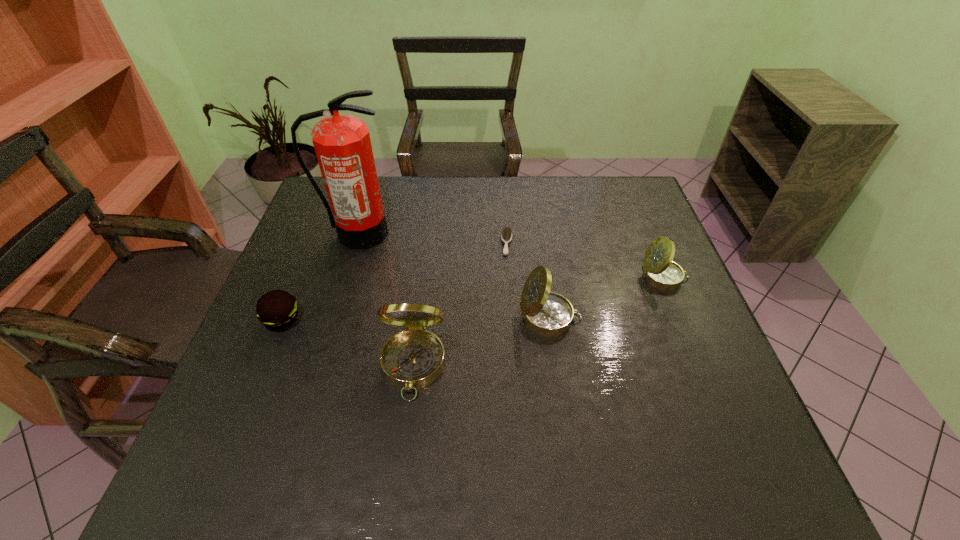
Where is `vacant space that's between the fourth object from right to left and the scrubbing brush`? Image resolution: width=960 pixels, height=540 pixels. vacant space that's between the fourth object from right to left and the scrubbing brush is located at coordinates (460, 305).

Identify the location of vacant point located between the fifth tallest object and the third farthest object. (473, 298).

Where is `free space between the rightmost object and the fifth object from left to right`? The height and width of the screenshot is (540, 960). free space between the rightmost object and the fifth object from left to right is located at coordinates (607, 298).

Identify which object is the fifth closest to the tallest object. Please provide its 2D coordinates. Your answer should be formatted as a tuple, i.e. [(x, y)], where the tuple contains the x and y coordinates of a point satisfying the conditions above.

[(659, 271)]

Where is `object that is the second closest to the leftmost compass`? object that is the second closest to the leftmost compass is located at coordinates click(277, 309).

Locate an element on the screen. This screenshot has height=540, width=960. the third closest compass to the tallest object is located at coordinates (659, 271).

The image size is (960, 540). I want to click on compass object that ranks as the third closest to the fire extinguisher, so [x=659, y=271].

Locate an element on the screen. free region that satisfies the following two spatial constraints: 1. with the dial facing the second object from right to left; 2. with the dial facing the third object from left to right is located at coordinates (557, 366).